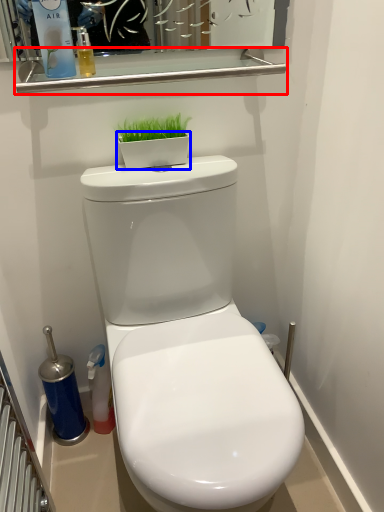
Question: Which object appears closest to the camera in this image, balustrade (highlighted by a red box) or flowerpot (highlighted by a blue box)?

Choices:
 (A) balustrade
 (B) flowerpot

Answer: (A)